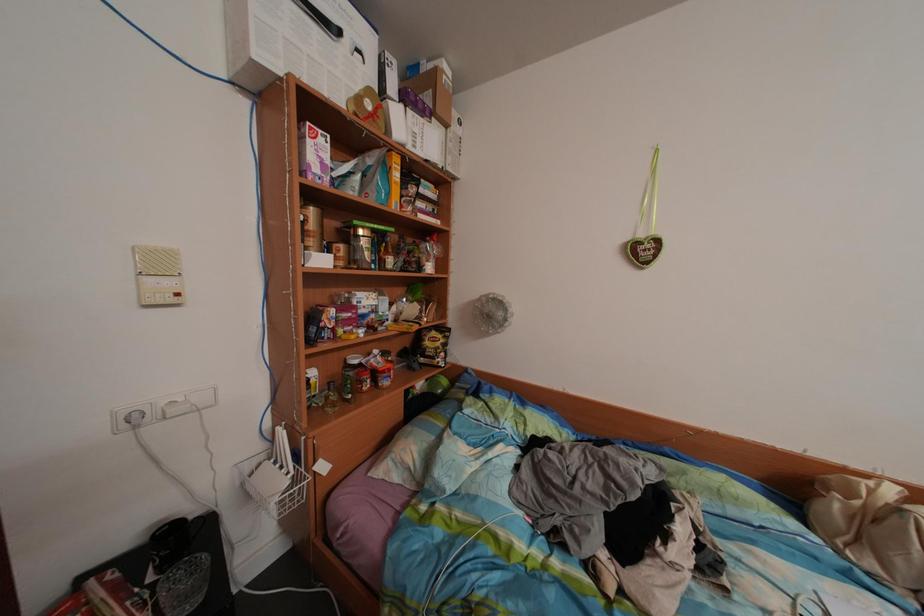
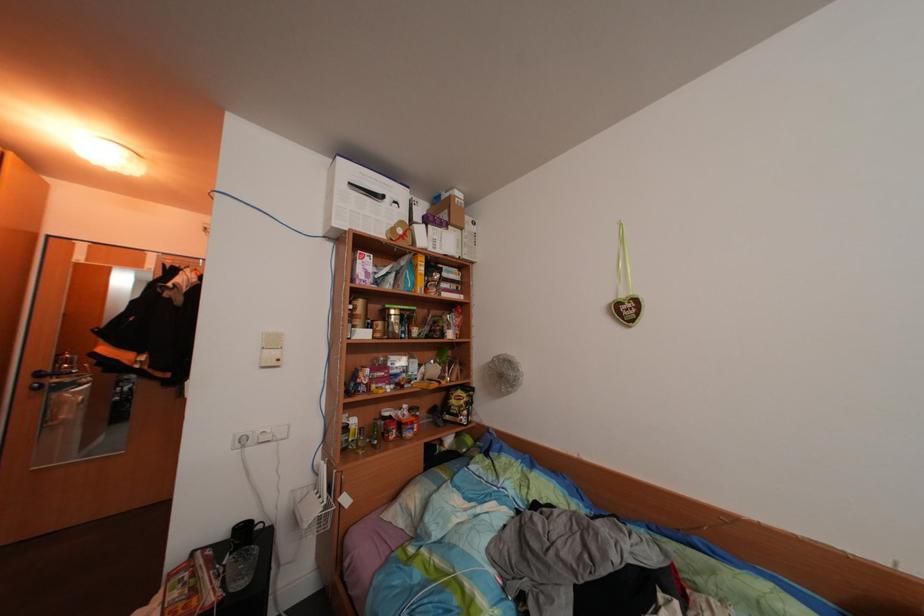
Which direction would the cameraman need to move to produce the second image?

The cameraman walked toward right, backward.